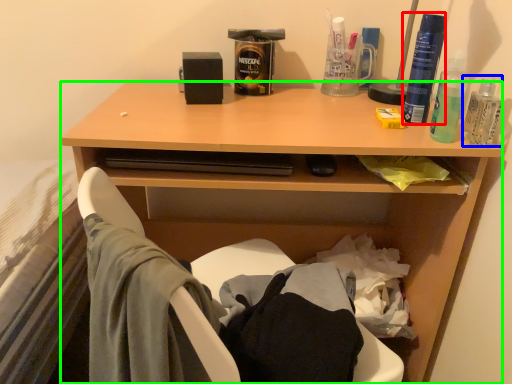
Question: Estimate the real-world distances between objects in this image. Which object is farther from bottle (highlighted by a red box), bottle (highlighted by a blue box) or desk (highlighted by a green box)?

Choices:
 (A) bottle
 (B) desk

Answer: (B)